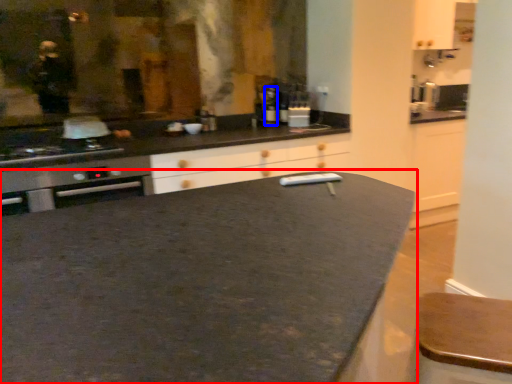
Question: Which of the following is the closest to the observer, countertop (highlighted by a red box) or bottle (highlighted by a blue box)?

Choices:
 (A) countertop
 (B) bottle

Answer: (A)